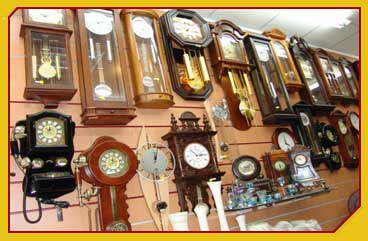
Where is `light red-brown panelled wall`? light red-brown panelled wall is located at coordinates (251, 140).